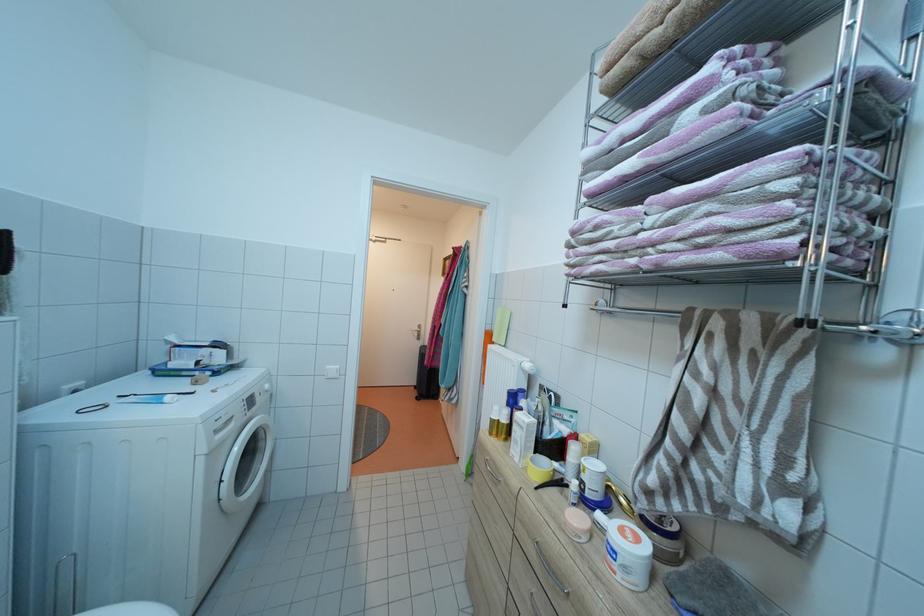
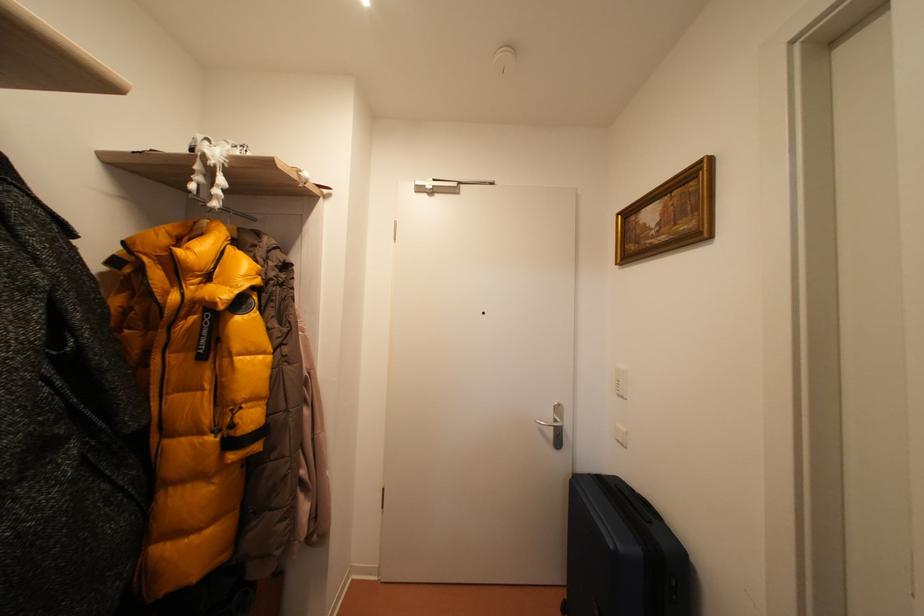
Question: In a continuous first-person perspective shot, in which direction is the camera moving?

Choices:
 (A) Left
 (B) Right
 (C) Forward
 (D) Backward

Answer: (C)